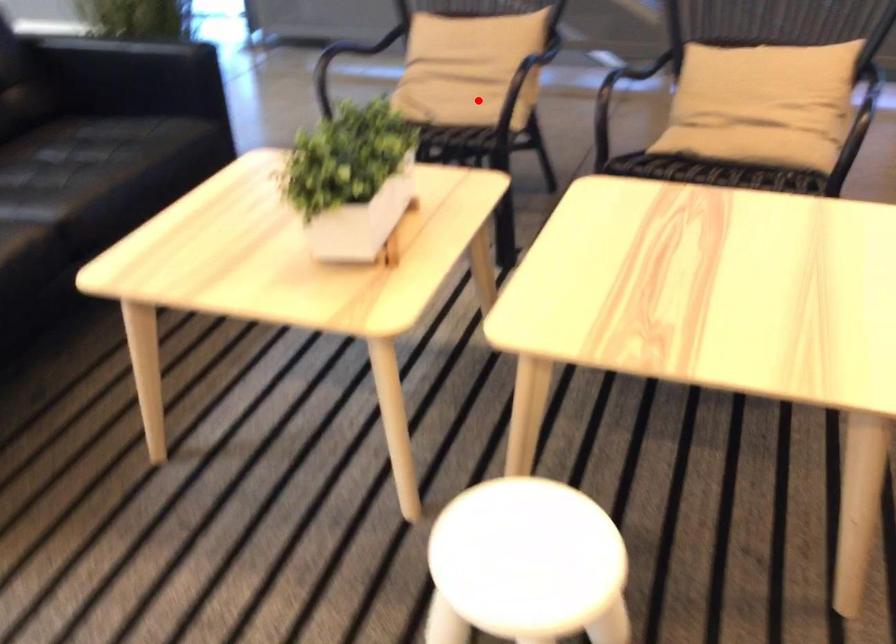
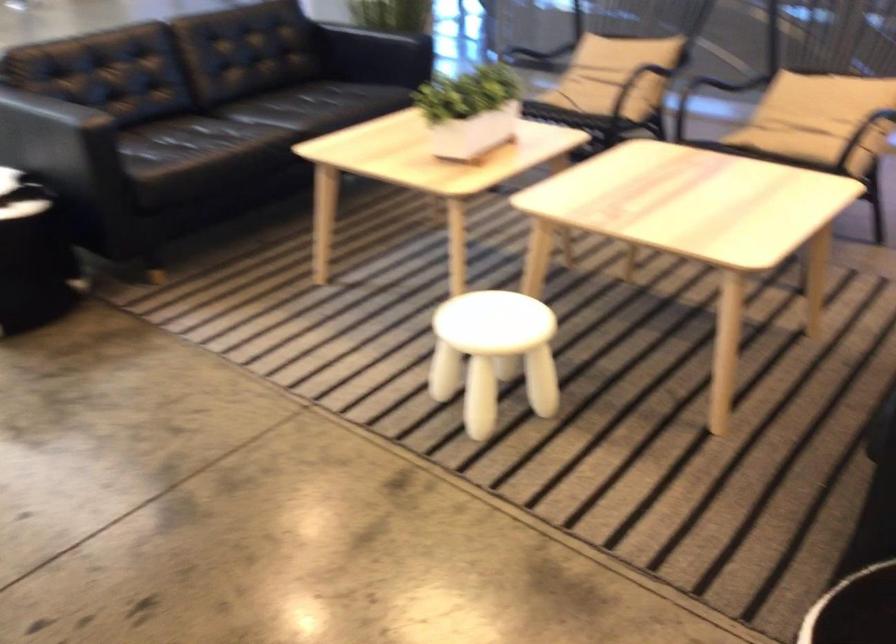
Question: I am providing you with two images of the same scene from different viewpoints. A red point is shown in image1. For the corresponding object point in image2, is it positioned nearer or farther from the camera?

Choices:
 (A) Nearer
 (B) Farther

Answer: (B)